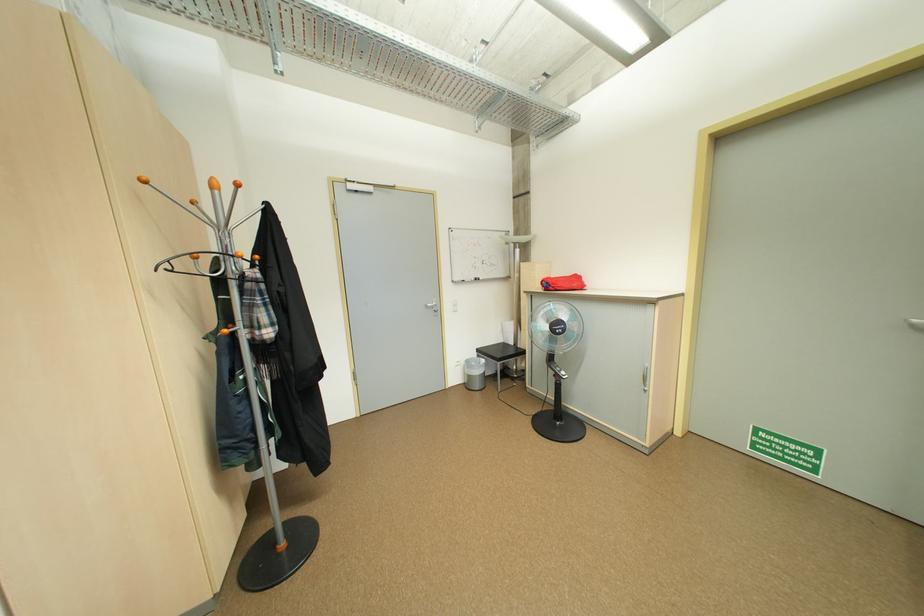
The image size is (924, 616). Find the location of `silver cabinet handle`. silver cabinet handle is located at coordinates (645, 378).